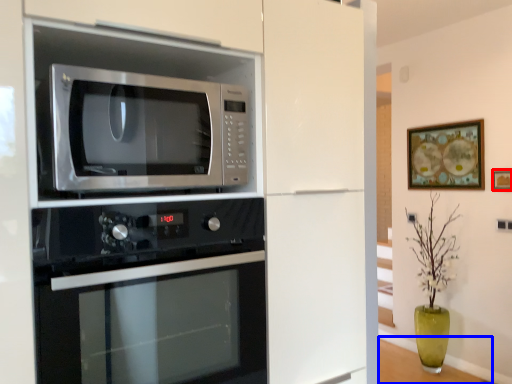
Question: Which object appears closest to the camera in this image, picture frame (highlighted by a red box) or table (highlighted by a blue box)?

Choices:
 (A) picture frame
 (B) table

Answer: (A)